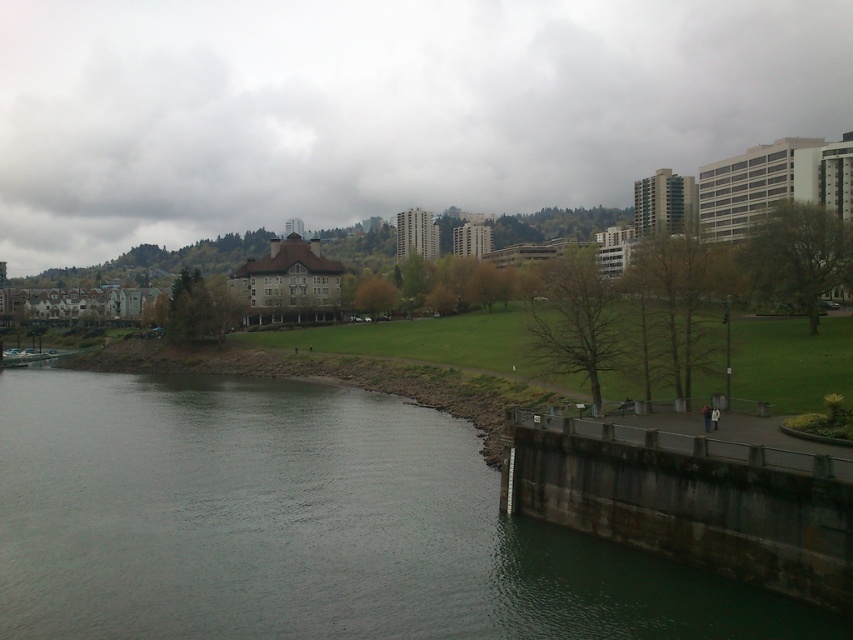
In the scene shown: You are standing at the concrete embankment on the right side of the river and want to walk to the point labeled point (416, 10). Which direction should you go relative to point (360, 554)?

You should go behind point (360, 554) to reach point (416, 10) because point (416, 10) is located behind point (360, 554).

You are a photographer wanting to capture the green grass at center and the dark gray concrete dam at lower right in the same frame. Based on their positions, which object would appear closer to the camera in the photo?

The green grass at center appears closer to the camera because the dark gray concrete dam at lower right is positioned behind it.

You are standing at the concrete embankment on the right side of the river and want to walk to both the point at coordinates (540, 38) and the point at coordinates (798, 484). Which point will you reach first?

You will reach the point at coordinates (540, 38) first because it is closer to you than the point at coordinates (798, 484), which is further away.